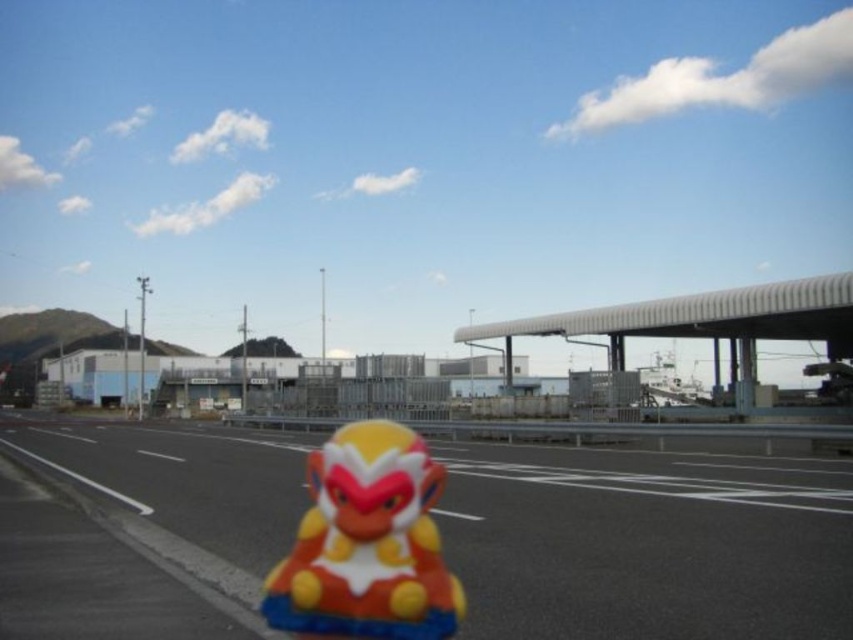
Question: Which point appears closest to the camera in this image?

Choices:
 (A) (416, 630)
 (B) (494, 474)

Answer: (A)

Question: Which of the following is the farthest from the observer?

Choices:
 (A) glossy plastic monkey at center
 (B) smooth asphalt highway at center

Answer: (A)

Question: Does smooth asphalt highway at center come behind glossy plastic monkey at center?

Choices:
 (A) no
 (B) yes

Answer: (A)

Question: Can you confirm if smooth asphalt highway at center is positioned to the left of glossy plastic monkey at center?

Choices:
 (A) yes
 (B) no

Answer: (A)

Question: Is smooth asphalt highway at center bigger than glossy plastic monkey at center?

Choices:
 (A) yes
 (B) no

Answer: (A)